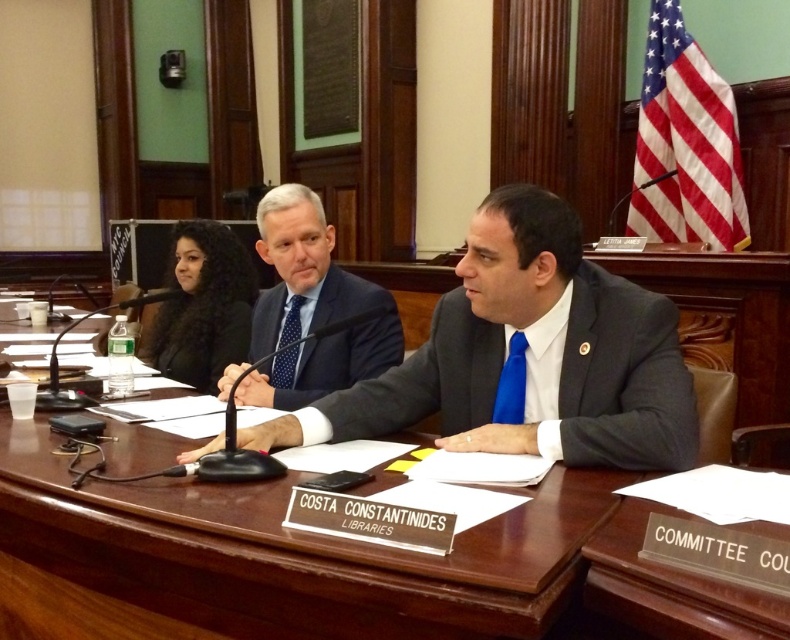
How far apart are blue silk tie at center and polka dot silk tie at center?

A distance of 28.03 inches exists between blue silk tie at center and polka dot silk tie at center.

Which is behind, point (521, 385) or point (288, 380)?

Point (288, 380)

This screenshot has width=790, height=640. What do you see at coordinates (510, 384) in the screenshot?
I see `blue silk tie at center` at bounding box center [510, 384].

The width and height of the screenshot is (790, 640). Identify the location of blue silk tie at center. (510, 384).

Can you confirm if wooden table at center is shorter than dark blue textured suit at center?

Yes.

Measure the distance between wooden table at center and dark blue textured suit at center.

The distance of wooden table at center from dark blue textured suit at center is 36.61 inches.

Which is behind, point (621, 600) or point (337, 268)?

The point (337, 268) is more distant.

This screenshot has width=790, height=640. Find the location of `wooden table at center`. wooden table at center is located at coordinates (674, 582).

How far apart are brown wooden table at center and polka dot silk tie at center?

brown wooden table at center and polka dot silk tie at center are 31.99 inches apart.

Is brown wooden table at center bigger than polka dot silk tie at center?

Indeed, brown wooden table at center has a larger size compared to polka dot silk tie at center.

Describe the element at coordinates (269, 561) in the screenshot. I see `brown wooden table at center` at that location.

Find the location of a particular element. brown wooden table at center is located at coordinates (269, 561).